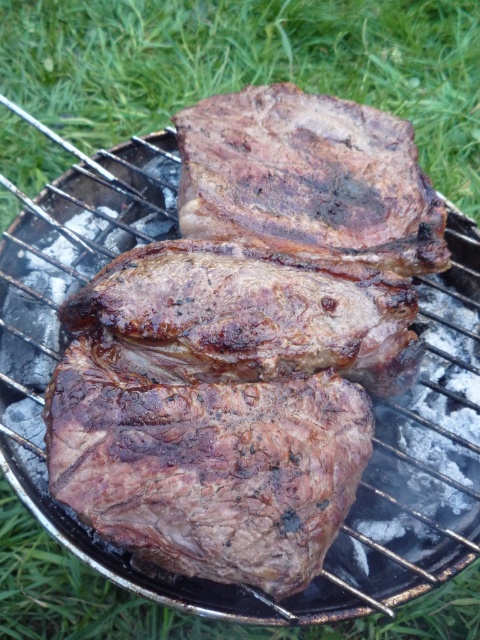
You are standing in front of a portable grill and see the green grass at upper center and the charred seared steak at center. Which object is closer to you?

The charred seared steak at center is closer to you than the green grass at upper center because the green grass at upper center is further away.

You are a photographer trying to capture the charred seared steak at center and the green grass at upper center in a single frame. Based on their sizes, which object should you focus on to ensure both fit clearly in the photo?

The green grass at upper center is bigger than the charred seared steak at center, so focusing on the green grass at upper center would ensure both fit clearly in the photo since it occupies more space in the frame.

Based on the scene description, where is the green grass at upper center located in terms of coordinates?

The green grass at upper center is located at coordinates point (x=249, y=65).